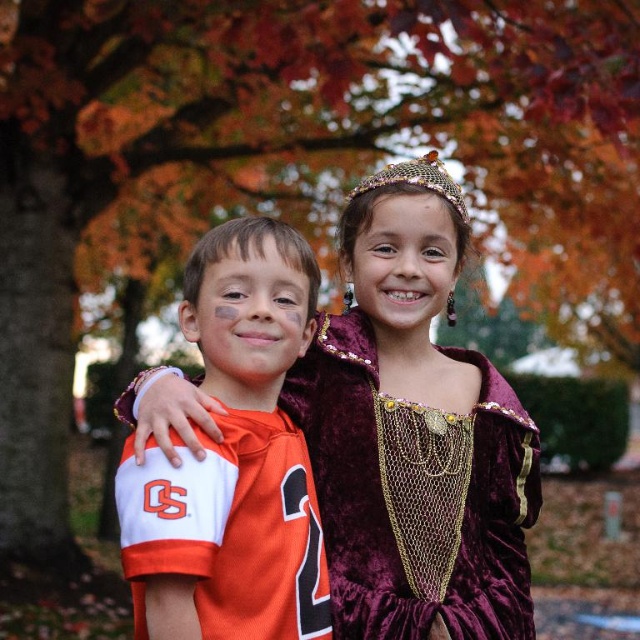
Question: Which is nearer to the orange jersey at center?

Choices:
 (A) gold mesh crown at upper center
 (B) velvet maroon dress at center

Answer: (B)

Question: Is velvet maroon dress at center bigger than orange jersey at center?

Choices:
 (A) no
 (B) yes

Answer: (B)

Question: From the image, what is the correct spatial relationship of orange jersey at center in relation to gold mesh crown at upper center?

Choices:
 (A) right
 (B) left

Answer: (B)

Question: Which of the following is the closest to the observer?

Choices:
 (A) gold mesh crown at upper center
 (B) velvet maroon dress at center

Answer: (B)

Question: Does velvet maroon dress at center appear over orange jersey at center?

Choices:
 (A) yes
 (B) no

Answer: (A)

Question: Which object is farther from the camera taking this photo?

Choices:
 (A) gold mesh crown at upper center
 (B) orange jersey at center

Answer: (A)